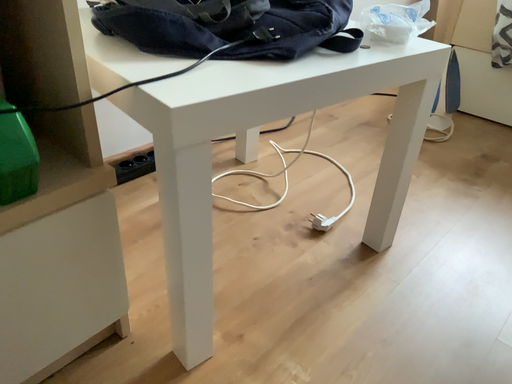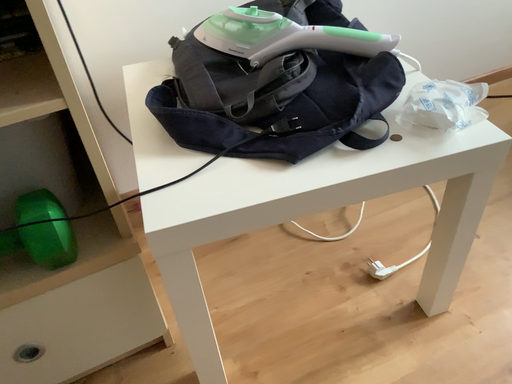
Question: How did the camera likely rotate when shooting the video?

Choices:
 (A) rotated upward
 (B) rotated downward

Answer: (B)